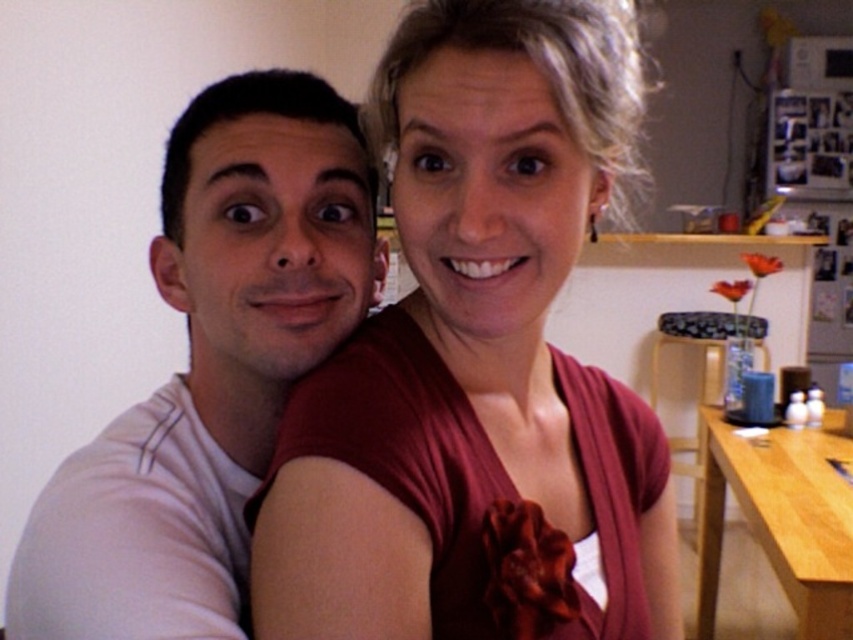
Can you confirm if white matte t-shirt at left is smaller than blue fabric stool at right?

Correct, white matte t-shirt at left occupies less space than blue fabric stool at right.

Can you confirm if white matte t-shirt at left is bigger than blue fabric stool at right?

Incorrect, white matte t-shirt at left is not larger than blue fabric stool at right.

Describe the element at coordinates (210, 368) in the screenshot. I see `white matte t-shirt at left` at that location.

Where is `white matte t-shirt at left`? white matte t-shirt at left is located at coordinates (210, 368).